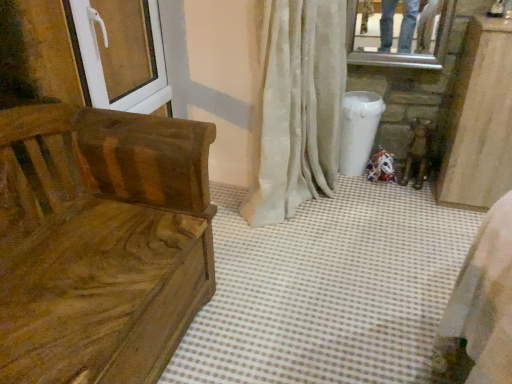
Question: Can you confirm if white textured curtain at center is wider than white plastic screen door at upper left?

Choices:
 (A) no
 (B) yes

Answer: (B)

Question: From the image's perspective, is white textured curtain at center above white plastic screen door at upper left?

Choices:
 (A) no
 (B) yes

Answer: (A)

Question: Are white textured curtain at center and white plastic screen door at upper left far apart?

Choices:
 (A) yes
 (B) no

Answer: (B)

Question: Can you confirm if white textured curtain at center is shorter than white plastic screen door at upper left?

Choices:
 (A) no
 (B) yes

Answer: (A)

Question: Is white textured curtain at center turned away from white plastic screen door at upper left?

Choices:
 (A) no
 (B) yes

Answer: (B)

Question: From a real-world perspective, is white textured curtain at center on white plastic screen door at upper left?

Choices:
 (A) no
 (B) yes

Answer: (A)

Question: Does white textured curtain at center have a greater width compared to wooden bench at left?

Choices:
 (A) no
 (B) yes

Answer: (A)

Question: Is white textured curtain at center bigger than wooden bench at left?

Choices:
 (A) yes
 (B) no

Answer: (B)

Question: Is white textured curtain at center closer to the viewer compared to wooden bench at left?

Choices:
 (A) no
 (B) yes

Answer: (A)

Question: Is white textured curtain at center in contact with wooden bench at left?

Choices:
 (A) yes
 (B) no

Answer: (B)

Question: Is white textured curtain at center looking in the opposite direction of wooden bench at left?

Choices:
 (A) no
 (B) yes

Answer: (A)

Question: Does white textured curtain at center have a lesser width compared to wooden bench at left?

Choices:
 (A) no
 (B) yes

Answer: (B)

Question: From a real-world perspective, is wooden bench at left over white textured curtain at center?

Choices:
 (A) yes
 (B) no

Answer: (B)